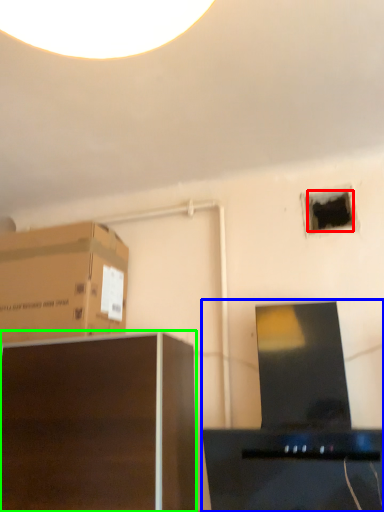
Question: Based on their relative distances, which object is farther from hole (highlighted by a red box)? Choose from desktop computer (highlighted by a blue box) and furniture (highlighted by a green box).

Choices:
 (A) desktop computer
 (B) furniture

Answer: (B)